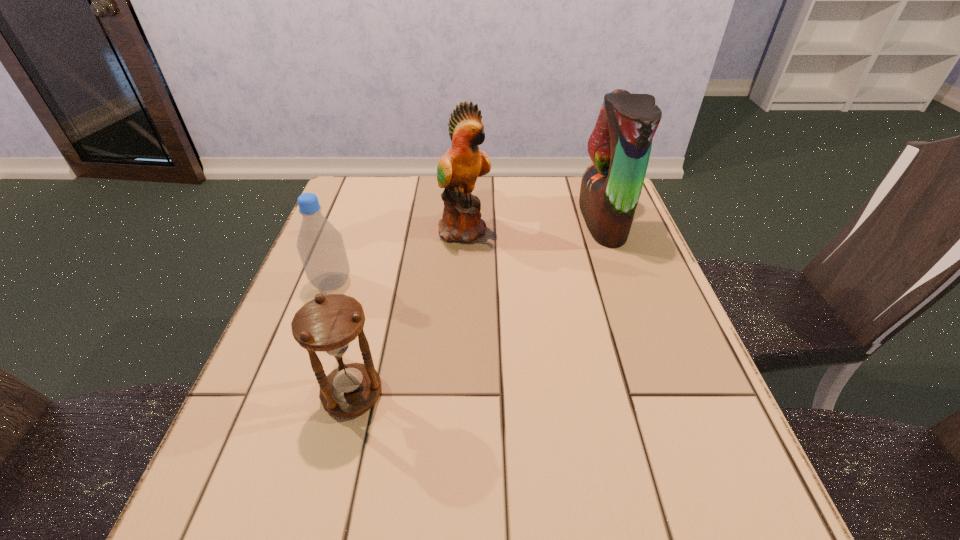
The width and height of the screenshot is (960, 540). I want to click on the closest object relative to the rightmost object, so click(458, 169).

At what (x,y) coordinates should I click in order to perform the action: click on blank space that satisfies the following two spatial constraints: 1. on the front-facing side of the third object from left to right; 2. on the front side of the third object from right to left. Please return your answer as a coordinate pair (x, y). Looking at the image, I should click on (457, 394).

You are a GUI agent. You are given a task and a screenshot of the screen. Output one action in this format:
    pyautogui.click(x=<x>, y=<y>)
    Task: Click on the vacant position in the image that satisfies the following two spatial constraints: 1. at the face of the right parrot; 2. on the front side of the bottle
    The image size is (960, 540).
    Given the screenshot: What is the action you would take?
    pyautogui.click(x=625, y=283)

You are a GUI agent. You are given a task and a screenshot of the screen. Output one action in this format:
    pyautogui.click(x=<x>, y=<y>)
    Task: Click on the blank space that satisfies the following two spatial constraints: 1. at the face of the right parrot; 2. on the front side of the second object from left to right
    This screenshot has height=540, width=960.
    Given the screenshot: What is the action you would take?
    pyautogui.click(x=664, y=394)